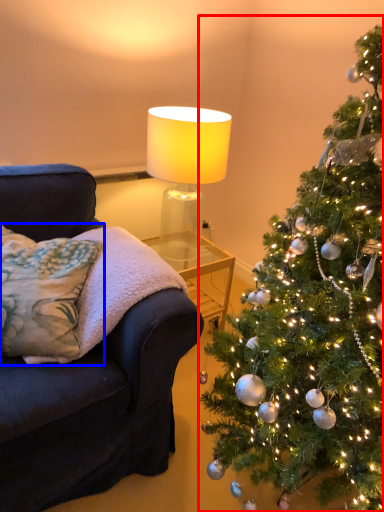
Question: Which object appears closest to the camera in this image, christmas tree (highlighted by a red box) or pillow (highlighted by a blue box)?

Choices:
 (A) christmas tree
 (B) pillow

Answer: (A)